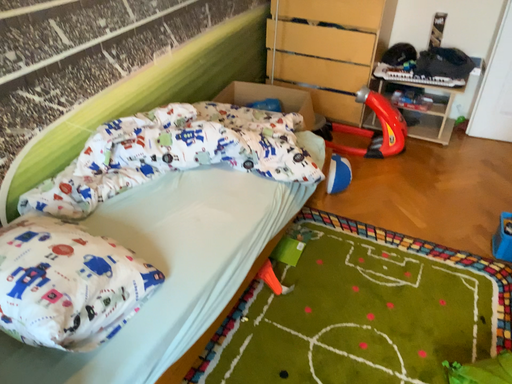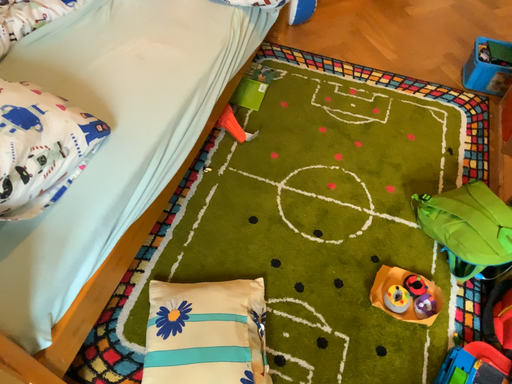
Question: Which way did the camera rotate in the video?

Choices:
 (A) rotated upward
 (B) rotated downward

Answer: (B)